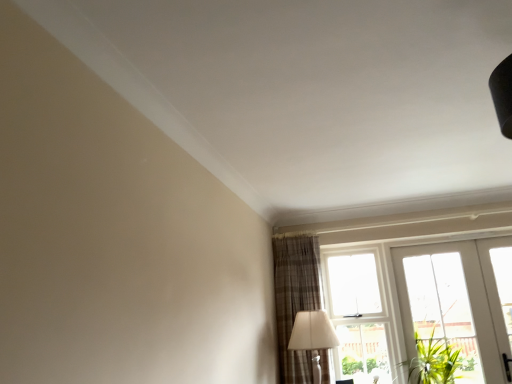
Question: From a real-world perspective, is white glossy door at lower right below white fabric lampshade at lower right?

Choices:
 (A) no
 (B) yes

Answer: (A)

Question: Are white glossy door at lower right and white fabric lampshade at lower right making contact?

Choices:
 (A) yes
 (B) no

Answer: (B)

Question: Considering the relative sizes of white glossy door at lower right and white fabric lampshade at lower right in the image provided, is white glossy door at lower right shorter than white fabric lampshade at lower right?

Choices:
 (A) yes
 (B) no

Answer: (B)

Question: Is white glossy door at lower right to the right of white fabric lampshade at lower right from the viewer's perspective?

Choices:
 (A) yes
 (B) no

Answer: (A)

Question: Can you confirm if white glossy door at lower right is thinner than white fabric lampshade at lower right?

Choices:
 (A) no
 (B) yes

Answer: (B)

Question: Can you confirm if white glossy door at lower right is wider than white fabric lampshade at lower right?

Choices:
 (A) yes
 (B) no

Answer: (B)

Question: From a real-world perspective, does plaid fabric curtain at lower right sit lower than white fabric lampshade at lower right?

Choices:
 (A) yes
 (B) no

Answer: (B)

Question: From the image's perspective, is plaid fabric curtain at lower right above white fabric lampshade at lower right?

Choices:
 (A) yes
 (B) no

Answer: (A)

Question: Does plaid fabric curtain at lower right have a greater height compared to white fabric lampshade at lower right?

Choices:
 (A) no
 (B) yes

Answer: (B)

Question: Could you tell me if plaid fabric curtain at lower right is facing white fabric lampshade at lower right?

Choices:
 (A) no
 (B) yes

Answer: (B)

Question: Can white fabric lampshade at lower right be found inside plaid fabric curtain at lower right?

Choices:
 (A) yes
 (B) no

Answer: (A)

Question: Does plaid fabric curtain at lower right have a greater width compared to white fabric lampshade at lower right?

Choices:
 (A) no
 (B) yes

Answer: (A)

Question: Is white fabric lampshade at lower right thinner than white glossy door at lower right?

Choices:
 (A) yes
 (B) no

Answer: (B)